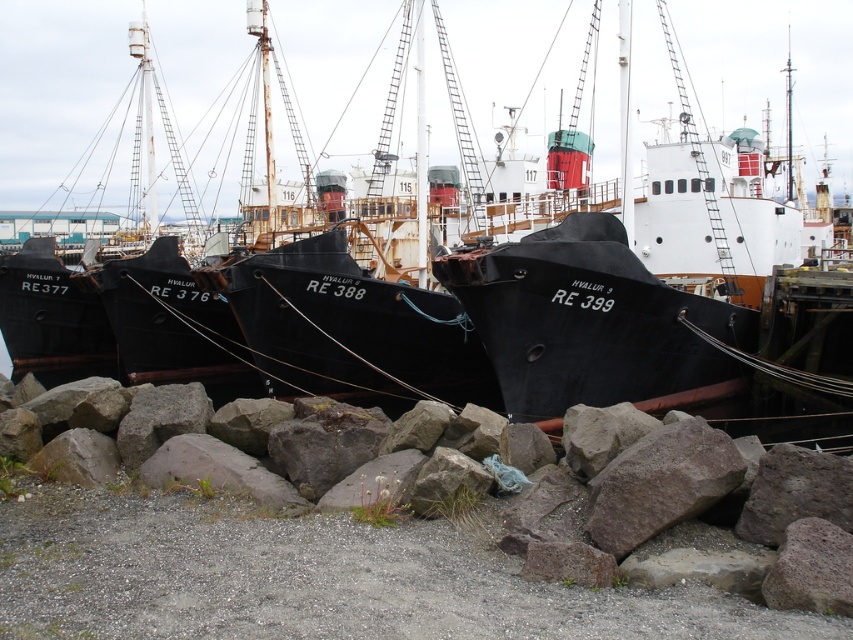
You are a marine biologist observing the harbor. You need to anchor a small research buoy next to the black matte boat at center. Given that the gray rough rock at lower center is in the way, can you estimate whether the space between them is sufficient to place the buoy?

The black matte boat at center is larger than the gray rough rock at lower center, so there should be enough space between them to place the buoy.

You are a marine biologist observing the harbor. You need to collect samples from the gray rough rock at lower center. Can you access it without moving the black matte boat at center?

The gray rough rock at lower center is behind the black matte boat at center, so you cannot access it without moving the boat.